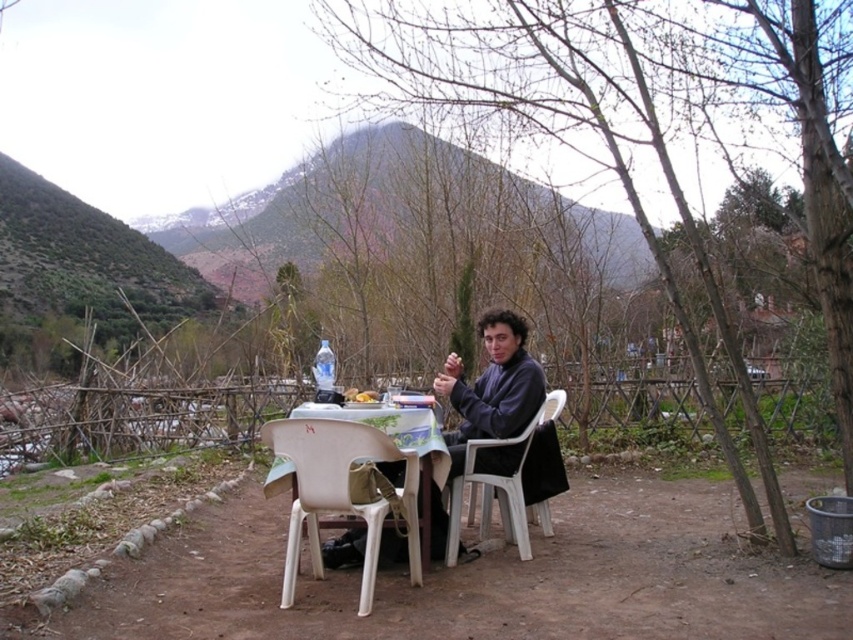
Which is more to the right, white plastic chair at lower center or dark blue sweater at center?

Positioned to the right is dark blue sweater at center.

Does point (347, 428) come farther from viewer compared to point (498, 376)?

No.

The width and height of the screenshot is (853, 640). What are the coordinates of `white plastic chair at lower center` in the screenshot? It's located at (340, 492).

Can you confirm if white plastic chair at lower center is positioned below white plastic chair at center?

Actually, white plastic chair at lower center is above white plastic chair at center.

In the scene shown: Who is shorter, white plastic chair at lower center or white plastic chair at center?

With less height is white plastic chair at lower center.

This screenshot has height=640, width=853. I want to click on white plastic chair at lower center, so click(340, 492).

Does dark blue sweater at center appear under white plastic chair at center?

Actually, dark blue sweater at center is above white plastic chair at center.

Between dark blue sweater at center and white plastic chair at center, which one has more height?

With more height is dark blue sweater at center.

Which is behind, point (521, 320) or point (546, 420)?

Point (546, 420)

What are the coordinates of `dark blue sweater at center` in the screenshot? It's located at (492, 387).